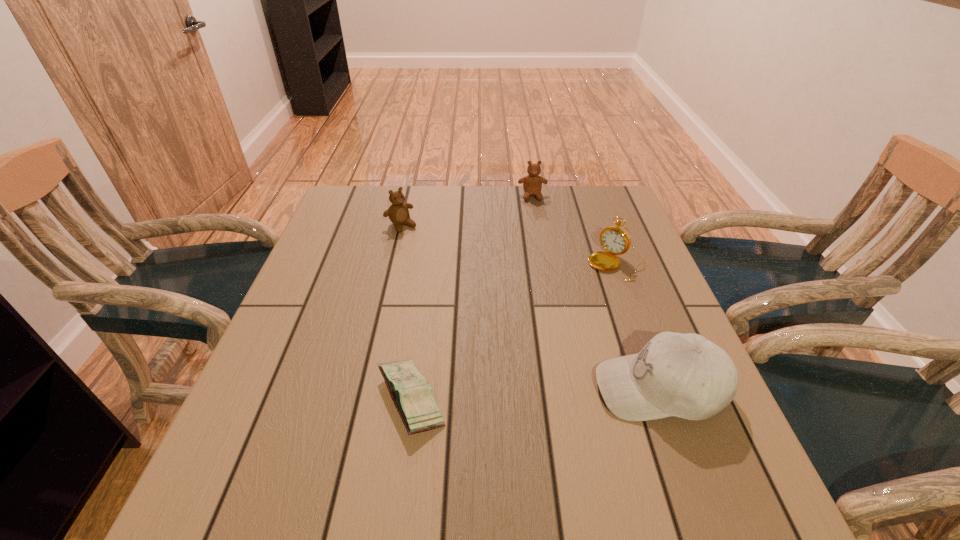
You are a GUI agent. You are given a task and a screenshot of the screen. Output one action in this format:
    pyautogui.click(x=<x>, y=<y>)
    Task: Click on the vacant area situated on the front-facing side of the baseball cap
    The width and height of the screenshot is (960, 540).
    Given the screenshot: What is the action you would take?
    pyautogui.click(x=441, y=388)

At what (x,y) coordinates should I click in order to perform the action: click on free space located 0.160m on the front-facing side of the left teddy bear. Please return your answer as a coordinate pair (x, y). The image size is (960, 540). Looking at the image, I should click on (436, 262).

Where is `vacant space located on the front-facing side of the left teddy bear`? The height and width of the screenshot is (540, 960). vacant space located on the front-facing side of the left teddy bear is located at coordinates (478, 308).

Locate an element on the screen. The height and width of the screenshot is (540, 960). free space located on the front-facing side of the left teddy bear is located at coordinates click(x=451, y=279).

Locate an element on the screen. The image size is (960, 540). free point located 0.270m on the face of the farther teddy bear is located at coordinates (540, 256).

This screenshot has width=960, height=540. What are the coordinates of `vacant area situated 0.150m on the face of the farther teddy bear` in the screenshot? It's located at (537, 230).

Locate an element on the screen. The image size is (960, 540). vacant region located on the face of the farther teddy bear is located at coordinates point(544,289).

Where is `blank area located on the face of the third nearest object`? This screenshot has width=960, height=540. blank area located on the face of the third nearest object is located at coordinates (567, 319).

Locate an element on the screen. free spot located on the face of the third nearest object is located at coordinates (581, 304).

Find the location of a particular element. free space located 0.150m on the face of the third nearest object is located at coordinates point(574,311).